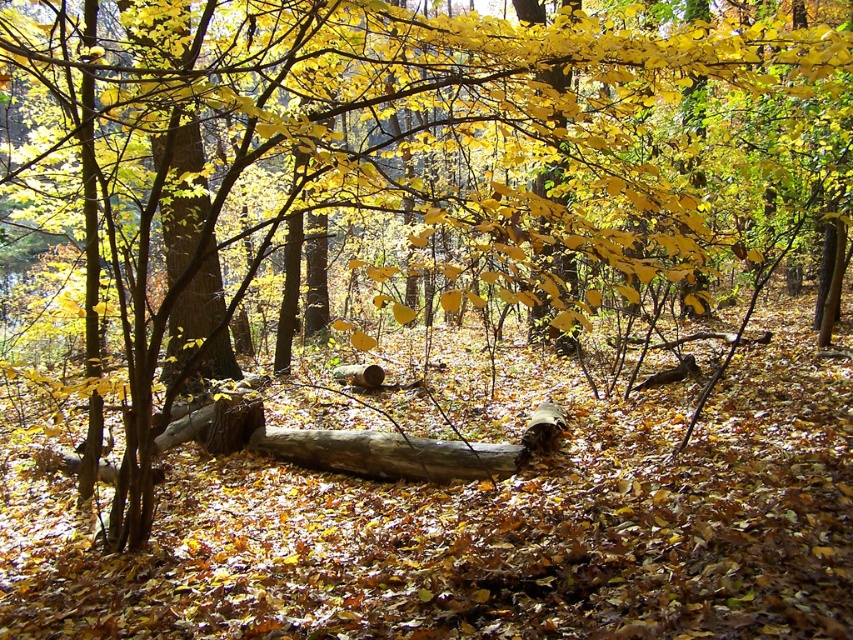
You are a hiker who wants to cross the forest path. You see the brown rough tree trunk at center and the smooth brown log at center. How far apart are these two objects?

The distance between the brown rough tree trunk at center and the smooth brown log at center is 8.75 feet.

You are a hiker trying to cross the forest path. You see a brown rough tree trunk at center and a smooth brown log at center. Which one is wider?

The smooth brown log at center is wider than the brown rough tree trunk at center.

You are standing at the center of the forest scene and see the point marked at coordinates (183,198). What object is located at that point?

The point at coordinates (183,198) corresponds to the brown rough tree trunk at center.